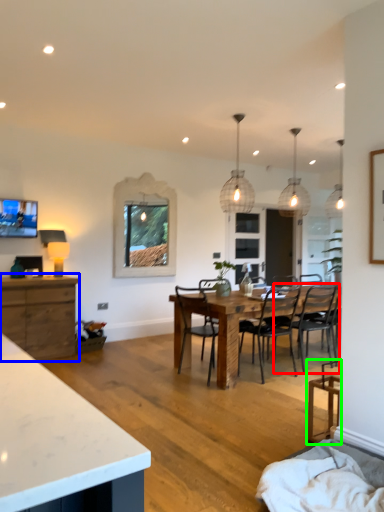
Question: Considering the real-world distances, which object is farthest from chair (highlighted by a red box)? cabinetry (highlighted by a blue box) or chair (highlighted by a green box)?

Choices:
 (A) cabinetry
 (B) chair

Answer: (A)